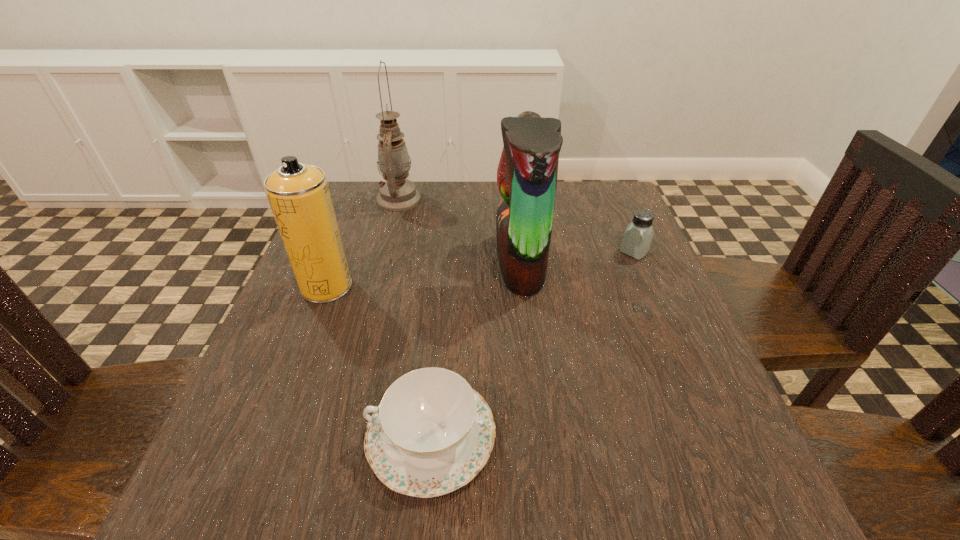
Locate an element on the screen. This screenshot has width=960, height=540. free location located at the face of the parrot is located at coordinates (365, 262).

I want to click on vacant space located on the front of the aerosol can, so click(x=295, y=369).

At what (x,y) coordinates should I click in order to perform the action: click on vacant area situated 0.350m on the left of the second shortest object. Please return your answer as a coordinate pair (x, y). Image resolution: width=960 pixels, height=540 pixels. Looking at the image, I should click on (466, 252).

Where is `vacant space situated 0.180m on the handle side of the shortest object`? This screenshot has width=960, height=540. vacant space situated 0.180m on the handle side of the shortest object is located at coordinates (248, 435).

Identify the location of free space located 0.070m on the handle side of the shortest object. (322, 435).

Where is `free space located 0.180m on the handle side of the shortest object`? Image resolution: width=960 pixels, height=540 pixels. free space located 0.180m on the handle side of the shortest object is located at coordinates (248, 435).

Where is `oil lamp located at the far edge`? The width and height of the screenshot is (960, 540). oil lamp located at the far edge is located at coordinates (397, 193).

The width and height of the screenshot is (960, 540). In order to click on parrot positioned at the far edge in this screenshot , I will do `click(527, 173)`.

The image size is (960, 540). What are the coordinates of `object at the near edge` in the screenshot? It's located at (432, 433).

This screenshot has width=960, height=540. I want to click on oil lamp positioned at the left edge, so click(x=397, y=193).